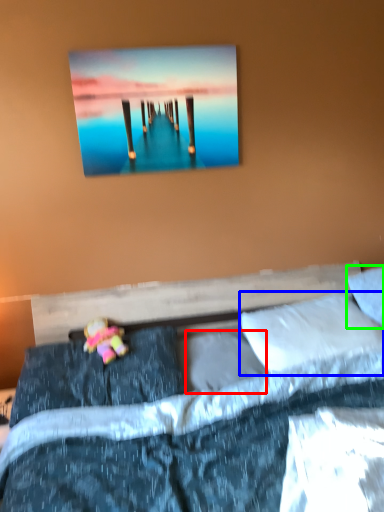
Question: Which object is the closest to the pillow (highlighted by a red box)? Choose among these: pillow (highlighted by a blue box) or pillow (highlighted by a green box).

Choices:
 (A) pillow
 (B) pillow

Answer: (A)